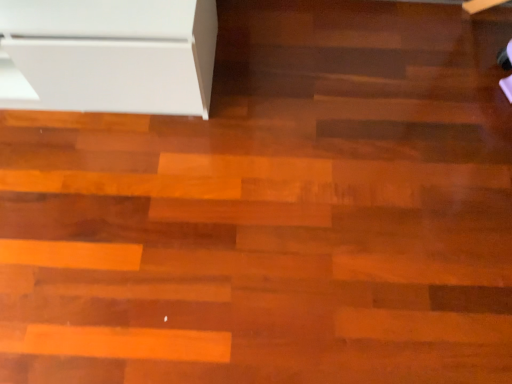
The height and width of the screenshot is (384, 512). What do you see at coordinates (108, 55) in the screenshot?
I see `white glossy cabinet at upper left` at bounding box center [108, 55].

From the picture: What is the approximate height of white glossy cabinet at upper left?

It is 14.52 inches.

At what (x,y) coordinates should I click in order to perform the action: click on white glossy cabinet at upper left. Please return your answer as a coordinate pair (x, y). The image size is (512, 384). Looking at the image, I should click on (108, 55).

The image size is (512, 384). I want to click on white glossy cabinet at upper left, so click(x=108, y=55).